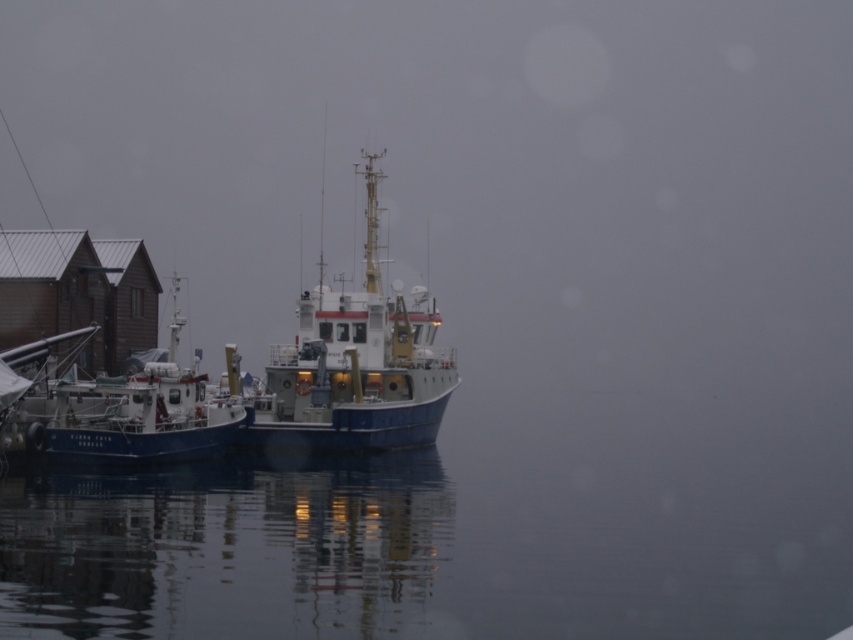
You are standing on the pier looking at the two boats. Which boat is located at the coordinates point (354, 364)?

The point (354, 364) corresponds to the blue matte boat at center.

You are a sailor trying to navigate between the blue matte boat at center and the blue matte boat at left. Based on their positions, which boat is blocking your path if you want to move forward towards the water?

The blue matte boat at center is positioned over the blue matte boat at left, meaning it is closer to you and thus blocking your path towards the water.